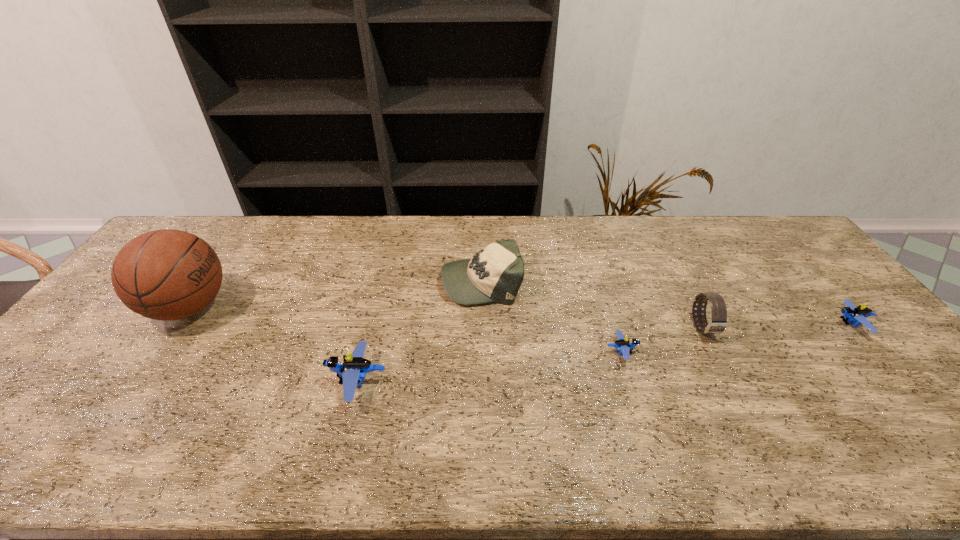
At what (x,y) coordinates should I click in order to perform the action: click on free space located 0.280m on the front-facing side of the fifth object from right to left. Please return your answer as a coordinate pair (x, y). The image size is (960, 540). Looking at the image, I should click on (215, 382).

Identify the location of free space located on the front-facing side of the fifth object from right to left. (252, 382).

Where is `free space located 0.260m on the front-facing side of the fifth object from right to left`? free space located 0.260m on the front-facing side of the fifth object from right to left is located at coordinates (224, 382).

Find the location of `free location located on the front-facing side of the fourth object from left to right`. free location located on the front-facing side of the fourth object from left to right is located at coordinates [x=656, y=352].

The height and width of the screenshot is (540, 960). What are the coordinates of `vacant area located on the front-facing side of the rightmost Lego` in the screenshot? It's located at (702, 324).

Image resolution: width=960 pixels, height=540 pixels. What are the coordinates of `free space located on the front-facing side of the rightmost Lego` in the screenshot? It's located at (802, 324).

This screenshot has height=540, width=960. In order to click on free space located 0.270m on the front-facing side of the rightmost Lego in this screenshot , I will do `click(737, 324)`.

I want to click on free point located on the front-facing side of the baseball cap, so click(x=383, y=281).

Identify the location of vacant space positioned 0.080m on the front-facing side of the baseball cap. (416, 281).

Identify the location of vacant region located 0.290m on the front-facing side of the baseball cap. Image resolution: width=960 pixels, height=540 pixels. (348, 281).